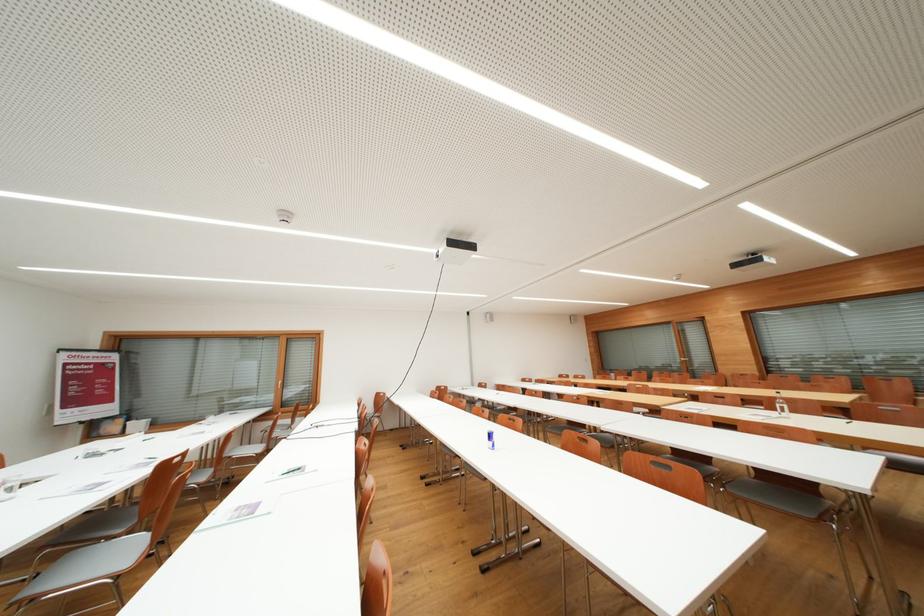
Find where to lift the purple paper folder. Please return your answer as a coordinate pair (x, y).

(84, 385)